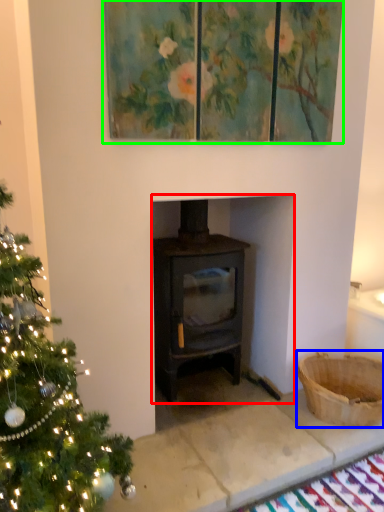
Question: Which object is the closest to the fireplace (highlighted by a red box)? Choose among these: basket (highlighted by a blue box) or oil painting (highlighted by a green box).

Choices:
 (A) basket
 (B) oil painting

Answer: (A)